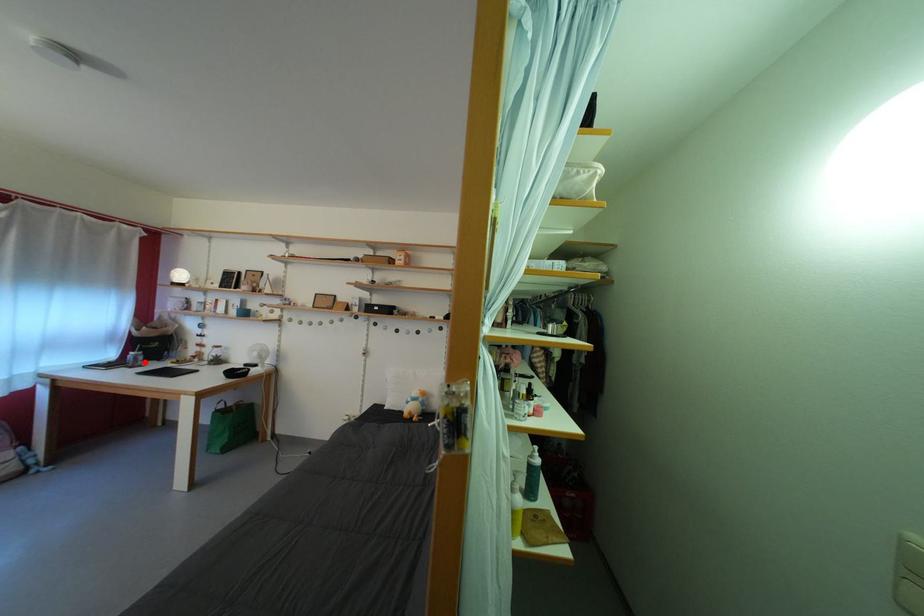
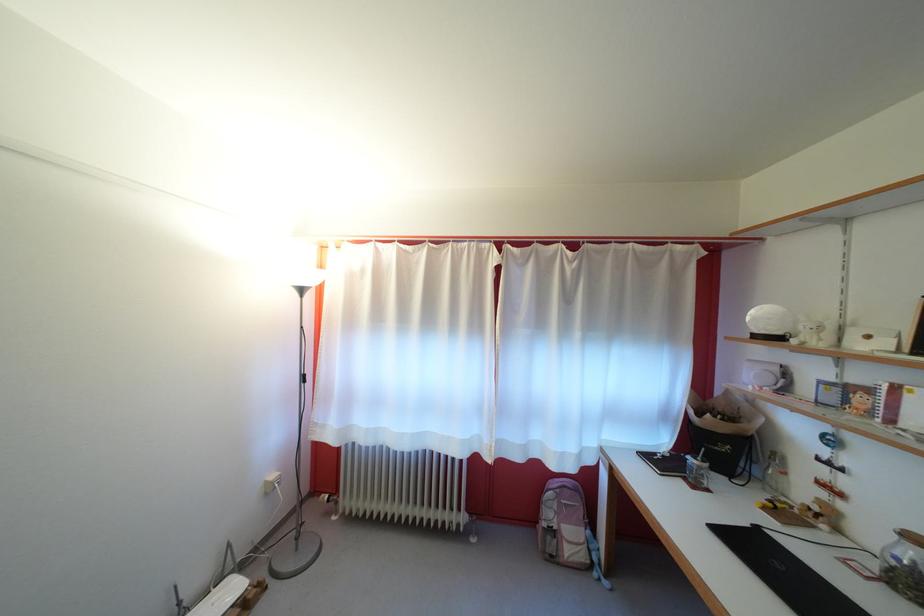
In the second image, find the point that corresponds to the highlighted location in the first image.

(708, 474)